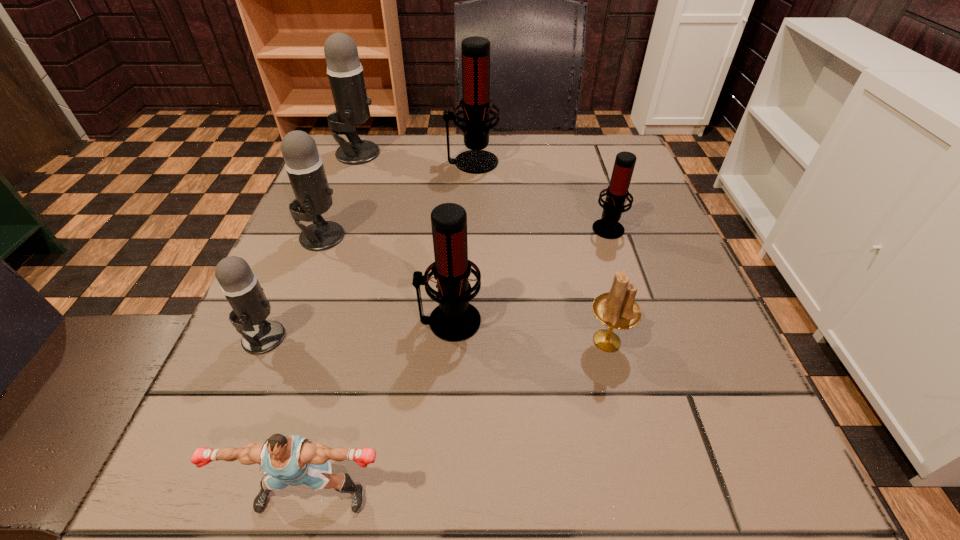
Identify the location of the biggest gray microphone. (344, 69).

Where is `the farthest red microphone`? the farthest red microphone is located at coordinates (476, 103).

Locate an element on the screen. The image size is (960, 540). the second nearest gray microphone is located at coordinates (304, 166).

This screenshot has width=960, height=540. Identify the location of the second smallest red microphone. (455, 319).

The height and width of the screenshot is (540, 960). What are the coordinates of `the rightmost microphone` in the screenshot? It's located at (608, 227).

Locate an element on the screen. This screenshot has width=960, height=540. the second farthest red microphone is located at coordinates (608, 227).

Identify the location of the smallest gray microphone. click(239, 284).

Locate an element on the screen. The height and width of the screenshot is (540, 960). candle holder is located at coordinates (616, 309).

Locate an element on the screen. The image size is (960, 540). red puncher is located at coordinates (293, 460).

Locate an element on the screen. puncher is located at coordinates (293, 460).